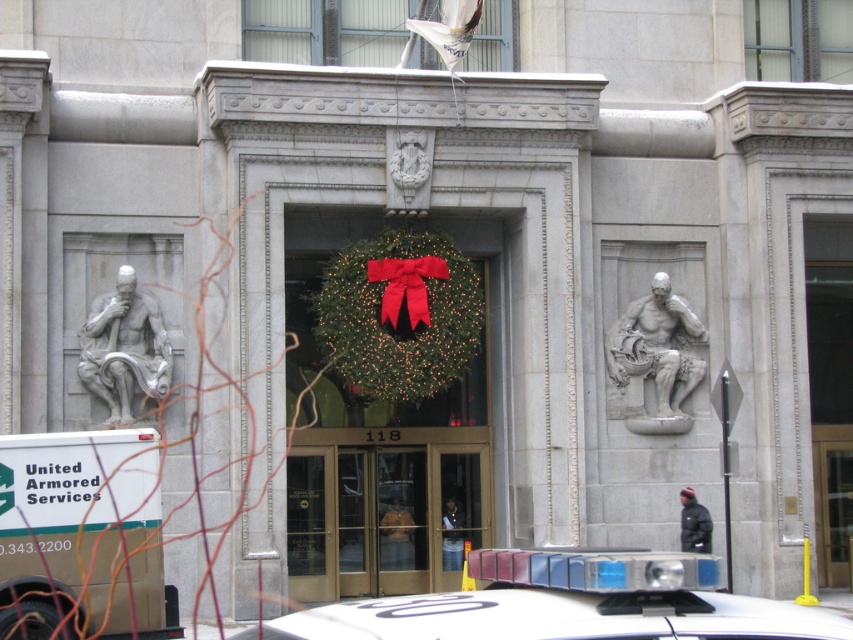
Question: Which point is closer to the camera?

Choices:
 (A) white matte van at lower left
 (B) green textured wreath at center
 (C) red satin bow at center
 (D) white plastic car at center

Answer: (D)

Question: Which of the following is the farthest from the observer?

Choices:
 (A) (355, 468)
 (B) (384, 292)
 (C) (650, 336)

Answer: (A)

Question: Which of the following is the farthest from the observer?

Choices:
 (A) (416, 260)
 (B) (134, 554)

Answer: (A)

Question: Is white matte van at lower left thinner than glass door at center?

Choices:
 (A) no
 (B) yes

Answer: (B)

Question: Is the position of gray stone sculpture at left more distant than that of red satin bow at center?

Choices:
 (A) yes
 (B) no

Answer: (B)

Question: Is glass door at center wider than green textured wreath at center?

Choices:
 (A) no
 (B) yes

Answer: (B)